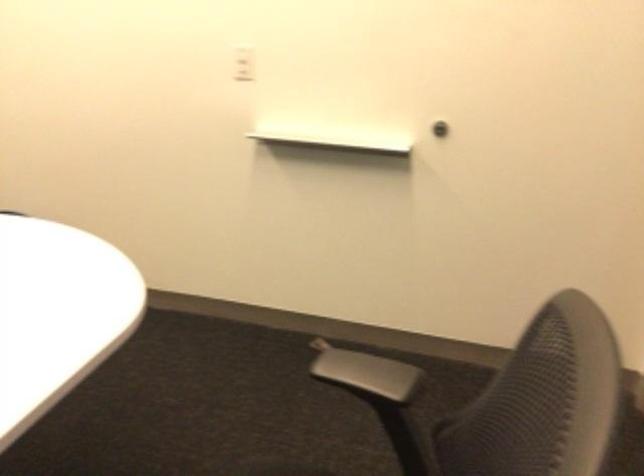
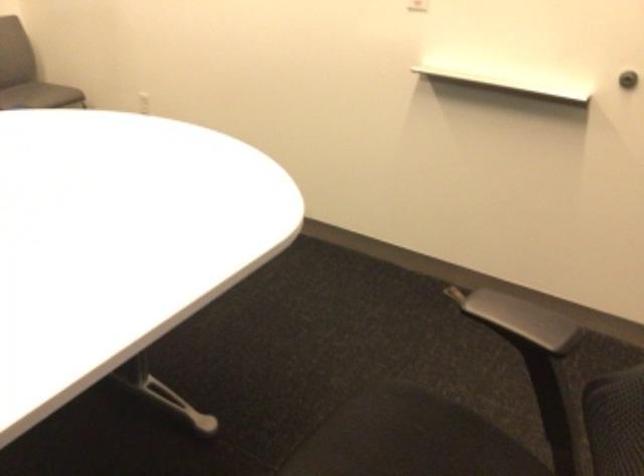
Find the pixel in the second image that matches pixel 328 129 in the first image.

(504, 72)